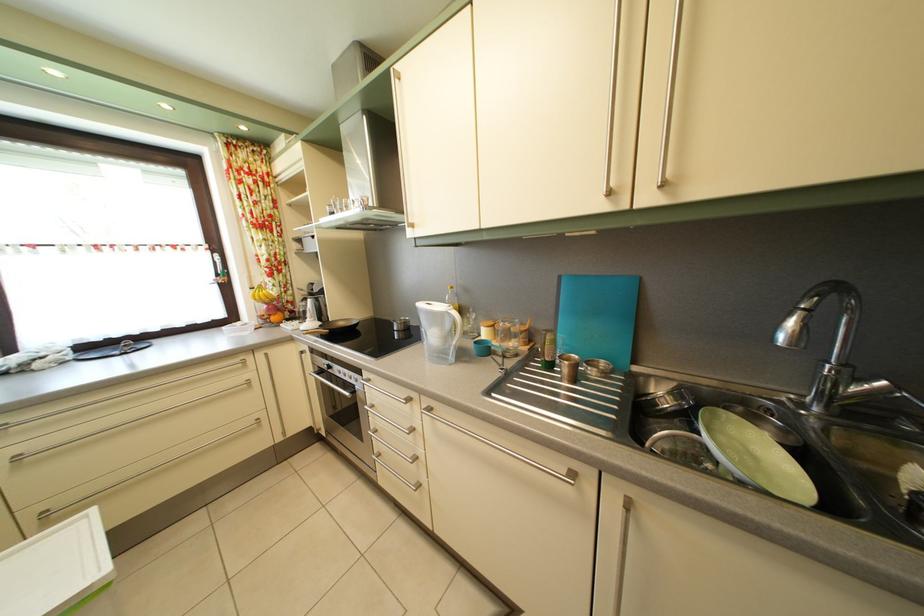
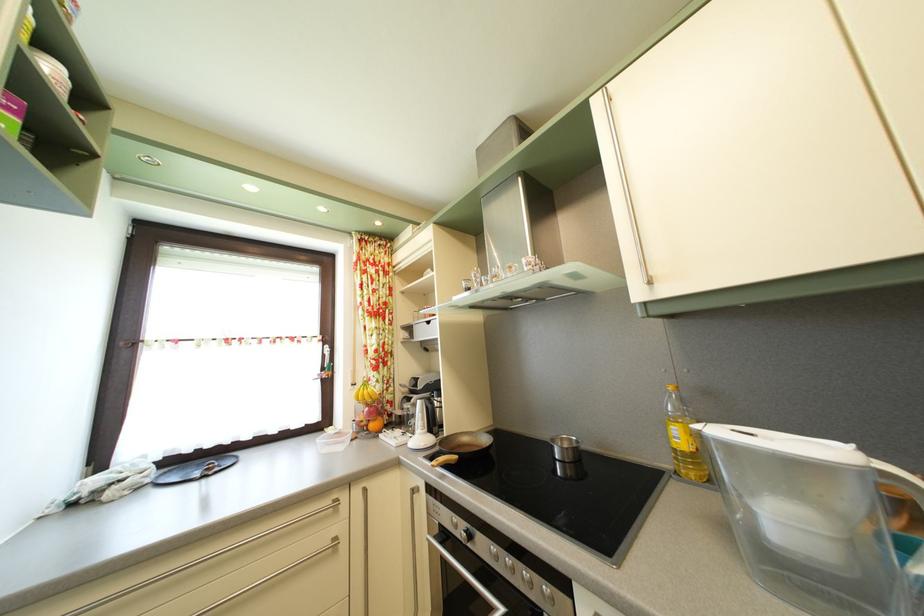
Question: The images are taken continuously from a first-person perspective. In which direction is your viewpoint rotating?

Choices:
 (A) Left
 (B) Right
 (C) Up
 (D) Down

Answer: (C)